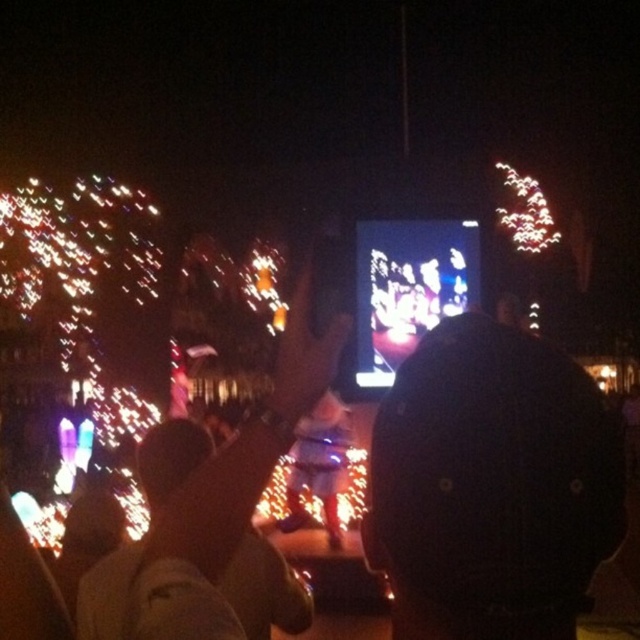
Is point (449, 577) closer to camera compared to point (397, 316)?

Yes, it is in front of point (397, 316).

Who is positioned more to the left, black matte jacket at center or shiny plastic phone at center?

black matte jacket at center is more to the left.

Between point (584, 438) and point (387, 312), which one is positioned in front?

Point (584, 438) is more forward.

Where is `black matte jacket at center`? black matte jacket at center is located at coordinates (492, 484).

Is shiny gold jacket at center thinner than shiny plastic phone at center?

Indeed, shiny gold jacket at center has a lesser width compared to shiny plastic phone at center.

Which is more to the left, shiny gold jacket at center or shiny plastic phone at center?

From the viewer's perspective, shiny gold jacket at center appears more on the left side.

The width and height of the screenshot is (640, 640). In order to click on shiny gold jacket at center in this screenshot , I will do `click(212, 493)`.

Can you confirm if black matte jacket at center is positioned above shiny gold jacket at center?

Incorrect, black matte jacket at center is not positioned above shiny gold jacket at center.

Which is in front, point (380, 548) or point (161, 509)?

Point (380, 548) is more forward.

This screenshot has width=640, height=640. Identify the location of black matte jacket at center. (492, 484).